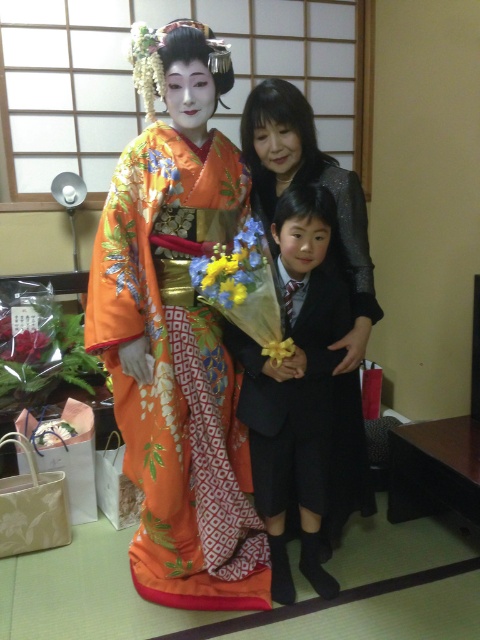
Question: Which point is closer to the camera taking this photo?

Choices:
 (A) (22, 333)
 (B) (313, 454)

Answer: (B)

Question: Which point is closer to the camera?

Choices:
 (A) black smooth suit at center
 (B) yellow fabric flower at center
 (C) silky red ribbon at lower left

Answer: (A)

Question: In this image, where is black smooth suit at center located relative to yellow matte flower at center?

Choices:
 (A) above
 (B) below

Answer: (B)

Question: Which of the following is the farthest from the observer?

Choices:
 (A) (331, 456)
 (B) (33, 339)
 (C) (154, 259)

Answer: (B)

Question: Where is black smooth suit at center located in relation to silky red ribbon at lower left in the image?

Choices:
 (A) above
 (B) below

Answer: (B)

Question: Does silky red ribbon at lower left have a larger size compared to yellow fabric flower at center?

Choices:
 (A) no
 (B) yes

Answer: (B)